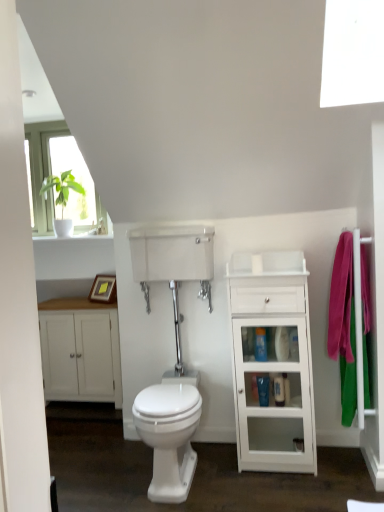
Where is `blank space to the left of white glossy bidet at center`? The height and width of the screenshot is (512, 384). blank space to the left of white glossy bidet at center is located at coordinates (102, 471).